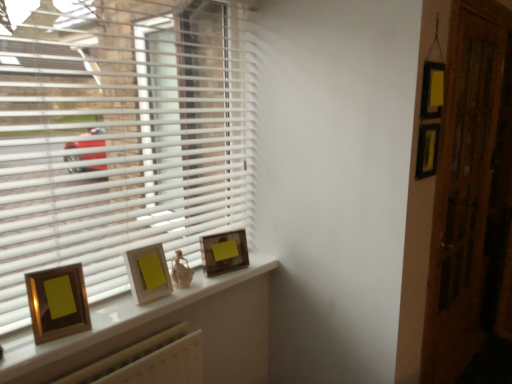
Locate an element on the screen. The image size is (512, 384). empty space that is in between matte gold picture frame at center, which appears as the 2th picture frame when viewed from the right, and wooden glossy picture frame at left, the 1th picture frame viewed from the front is located at coordinates (120, 316).